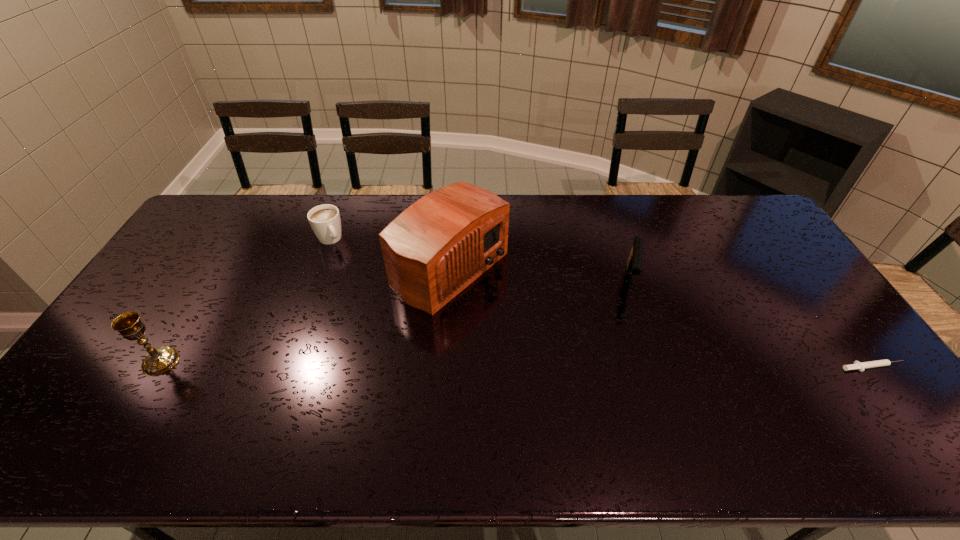
I want to click on free space located on the front-facing side of the radio receiver, so click(581, 350).

What are the coordinates of `cappuccino positioned at the far edge` in the screenshot? It's located at (325, 221).

Locate an element on the screen. This screenshot has height=540, width=960. radio receiver that is positioned at the far edge is located at coordinates (435, 248).

Locate an element on the screen. The height and width of the screenshot is (540, 960). object present at the left edge is located at coordinates (158, 361).

Locate an element on the screen. object at the right edge is located at coordinates (861, 366).

In the image, there is a desktop. Identify the location of vacant area at the far edge. The width and height of the screenshot is (960, 540). (661, 199).

Find the location of a particular element. Image resolution: width=960 pixels, height=540 pixels. vacant space at the near edge of the desktop is located at coordinates (240, 407).

This screenshot has height=540, width=960. In the image, there is a desktop. What are the coordinates of `vacant space at the left edge` in the screenshot? It's located at (156, 302).

In the image, there is a desktop. What are the coordinates of `free space at the right edge` in the screenshot? It's located at (837, 375).

This screenshot has width=960, height=540. Identify the location of free spot at the far right corner of the desktop. (735, 205).